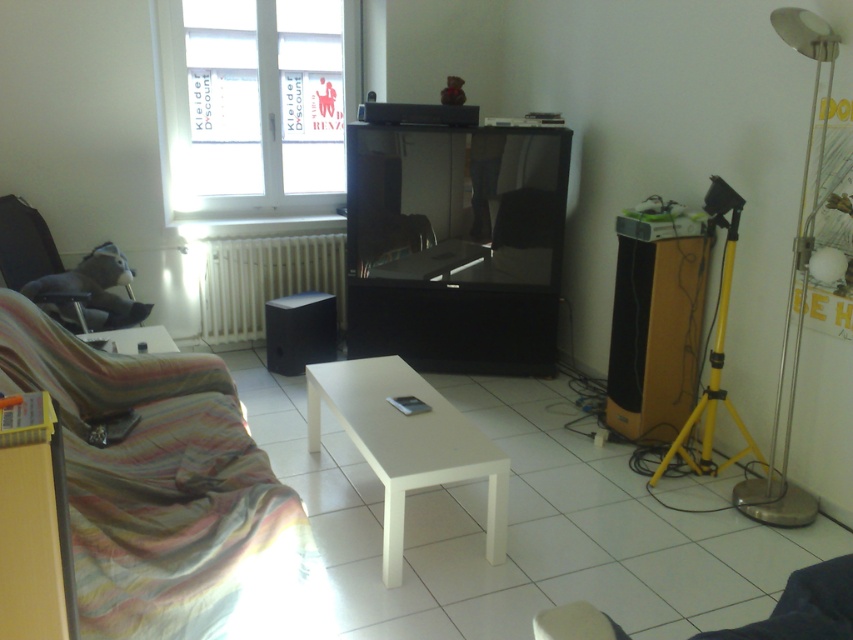
Question: Can you confirm if transparent glass window at upper left is positioned above white matte radiator at lower left?

Choices:
 (A) yes
 (B) no

Answer: (A)

Question: Does striped fabric couch at lower left have a smaller size compared to white matte radiator at lower left?

Choices:
 (A) no
 (B) yes

Answer: (A)

Question: Which point appears farthest from the camera in this image?

Choices:
 (A) (213, 252)
 (B) (305, 337)

Answer: (A)

Question: Is glossy black tv at center positioned at the back of yellow metallic tripod at right?

Choices:
 (A) yes
 (B) no

Answer: (A)

Question: Which object is the farthest from the white glossy table at lower left?

Choices:
 (A) transparent glass window at upper left
 (B) white matte radiator at lower left
 (C) black matte speaker at lower center
 (D) striped fabric couch at lower left

Answer: (A)

Question: Which object is positioned farthest from the white matte radiator at lower left?

Choices:
 (A) transparent glass window at upper left
 (B) white glossy table at center
 (C) white glossy table at lower left

Answer: (B)